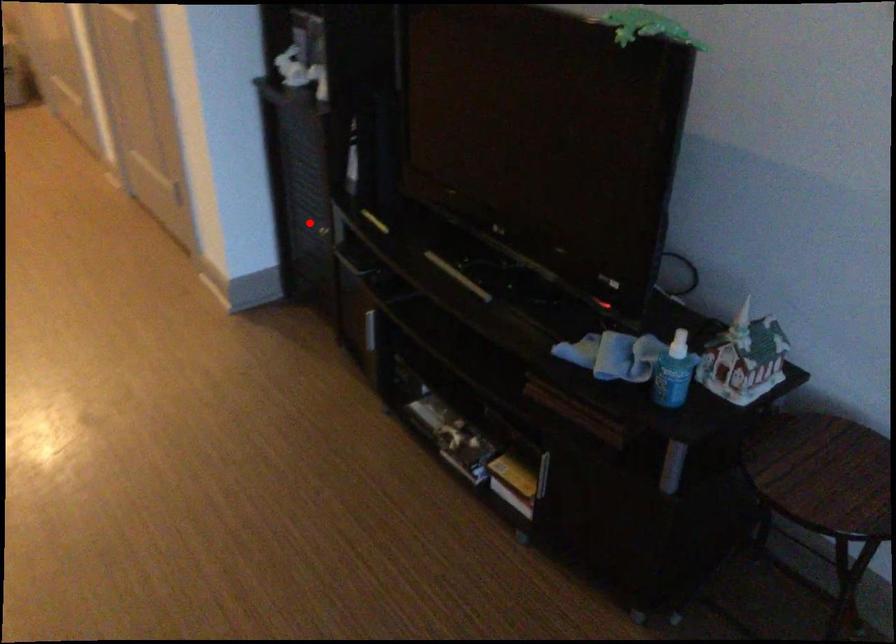
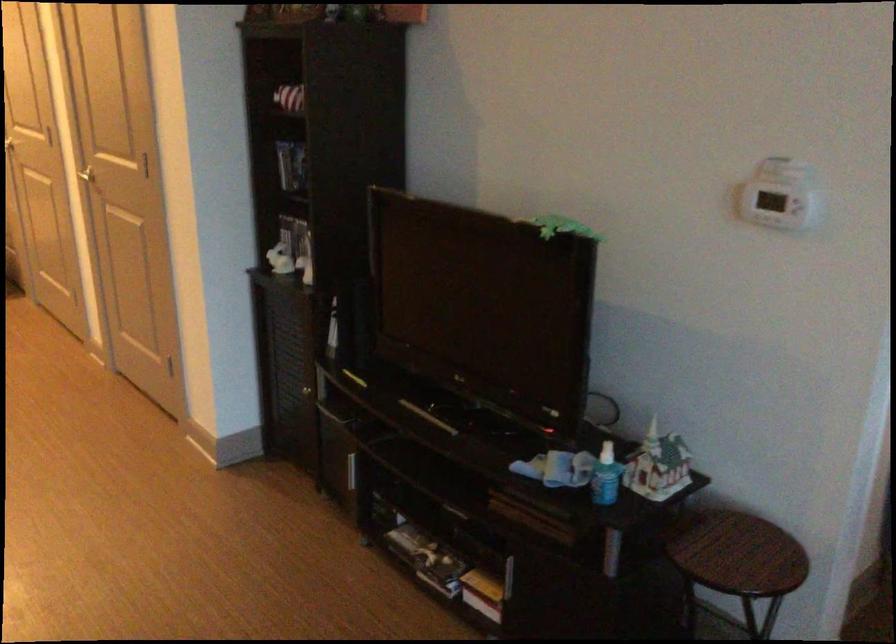
Locate, in the second image, the point that corresponds to the highlighted location in the first image.

(291, 383)